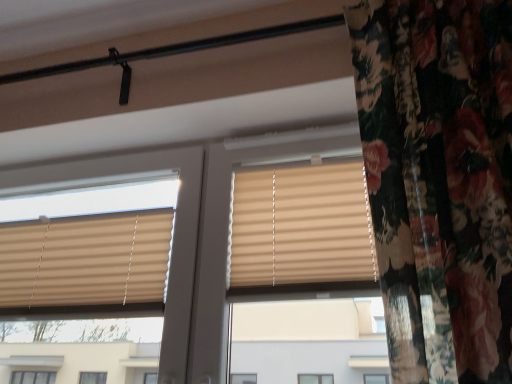
Question: In terms of height, does beige fabric blinds at center look taller or shorter compared to beige pleated blinds at upper left?

Choices:
 (A) tall
 (B) short

Answer: (A)

Question: Considering the positions of beige fabric blinds at center and beige pleated blinds at upper left in the image, is beige fabric blinds at center wider or thinner than beige pleated blinds at upper left?

Choices:
 (A) wide
 (B) thin

Answer: (B)

Question: Considering their positions, is beige fabric blinds at center located in front of or behind beige pleated blinds at upper left?

Choices:
 (A) behind
 (B) front

Answer: (B)

Question: From the image's perspective, is beige pleated blinds at upper left above or below beige fabric blinds at center?

Choices:
 (A) above
 (B) below

Answer: (B)

Question: Is beige pleated blinds at upper left inside the boundaries of beige fabric blinds at center, or outside?

Choices:
 (A) outside
 (B) inside

Answer: (A)

Question: From a real-world perspective, is beige pleated blinds at upper left physically located above or below beige fabric blinds at center?

Choices:
 (A) below
 (B) above

Answer: (A)

Question: Considering their positions, is beige pleated blinds at upper left located in front of or behind beige fabric blinds at center?

Choices:
 (A) front
 (B) behind

Answer: (B)